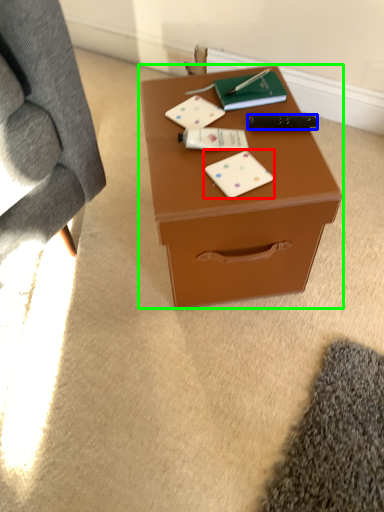
Question: Which is nearer to the card game (highlighted by a red box)? stationery (highlighted by a blue box) or table (highlighted by a green box).

Choices:
 (A) stationery
 (B) table

Answer: (B)